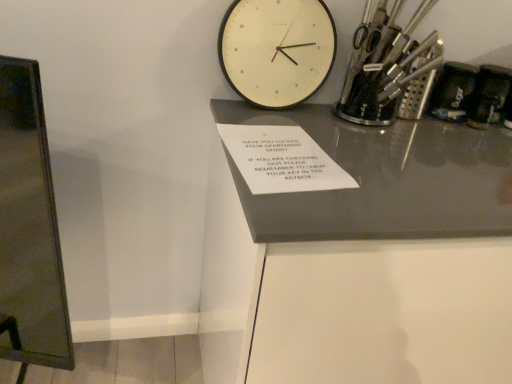
Question: Can you confirm if white glossy table at center is thinner than white matte wall clock at upper center?

Choices:
 (A) yes
 (B) no

Answer: (B)

Question: Does white glossy table at center have a lesser height compared to white matte wall clock at upper center?

Choices:
 (A) no
 (B) yes

Answer: (A)

Question: Is white matte wall clock at upper center a part of white glossy table at center?

Choices:
 (A) no
 (B) yes

Answer: (A)

Question: From a real-world perspective, is white glossy table at center physically below white matte wall clock at upper center?

Choices:
 (A) no
 (B) yes

Answer: (B)

Question: Is white glossy table at center located outside white matte wall clock at upper center?

Choices:
 (A) no
 (B) yes

Answer: (B)

Question: Based on their positions, is metallic silver utensils at upper right, which is the 2th stationery from right to left, located to the left or right of white matte wall clock at upper center?

Choices:
 (A) right
 (B) left

Answer: (A)

Question: From a real-world perspective, is metallic silver utensils at upper right, which is the 2th stationery from right to left, positioned above or below white matte wall clock at upper center?

Choices:
 (A) below
 (B) above

Answer: (B)

Question: In the image, is metallic silver utensils at upper right, the 1th stationery viewed from the left, positioned in front of or behind white matte wall clock at upper center?

Choices:
 (A) front
 (B) behind

Answer: (B)

Question: From the image's perspective, is metallic silver utensils at upper right, the 1th stationery viewed from the left, located above or below white matte wall clock at upper center?

Choices:
 (A) below
 (B) above

Answer: (A)

Question: Is white glossy table at center in front of or behind white matte wall clock at upper center in the image?

Choices:
 (A) behind
 (B) front

Answer: (B)

Question: Considering the positions of white glossy table at center and white matte wall clock at upper center in the image, is white glossy table at center taller or shorter than white matte wall clock at upper center?

Choices:
 (A) tall
 (B) short

Answer: (A)

Question: Is point click(x=389, y=160) closer or farther from the camera than point click(x=304, y=44)?

Choices:
 (A) closer
 (B) farther

Answer: (A)

Question: Is white glossy table at center situated inside white matte wall clock at upper center or outside?

Choices:
 (A) inside
 (B) outside

Answer: (B)

Question: Is white glossy table at center wider or thinner than metallic silver utensils at upper right, which is the 2th stationery from right to left?

Choices:
 (A) thin
 (B) wide

Answer: (B)

Question: From a real-world perspective, is white glossy table at center physically located above or below metallic silver utensils at upper right, the 1th stationery viewed from the left?

Choices:
 (A) above
 (B) below

Answer: (B)